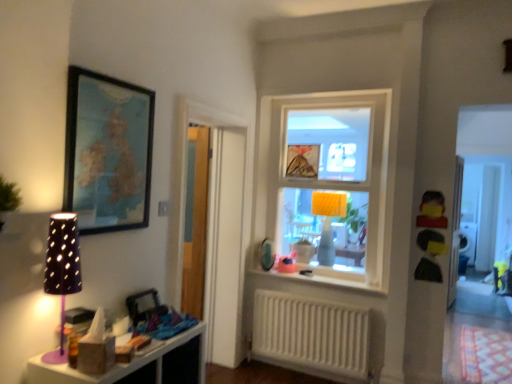
This screenshot has width=512, height=384. What do you see at coordinates (138, 365) in the screenshot?
I see `matte plastic shelf at lower left` at bounding box center [138, 365].

The height and width of the screenshot is (384, 512). Describe the element at coordinates (311, 336) in the screenshot. I see `white plastic radiator at lower center` at that location.

Where is `wooden framed map at upper left`? wooden framed map at upper left is located at coordinates (106, 152).

Find the location of a particular element. Image resolution: width=512 pixels, height=384 pixels. white glossy window sill at center is located at coordinates (324, 280).

Measure the distance between transparent wooden door at left and white plastic radiator at lower center.

They are 26.31 inches apart.

The image size is (512, 384). What are the coordinates of `radiator below the transparent wooden door at left (from a real-world perspective)` in the screenshot? It's located at (311, 336).

Which of these two, transparent wooden door at left or white plastic radiator at lower center, is smaller?

Smaller between the two is white plastic radiator at lower center.

Between transparent wooden door at left and white plastic radiator at lower center, which one appears on the right side from the viewer's perspective?

Positioned to the right is white plastic radiator at lower center.

Considering the positions of objects matte plastic toy at center, positioned as the first toy in bottom-to-top order, and white glossy window sill at center in the image provided, who is more to the left, matte plastic toy at center, positioned as the first toy in bottom-to-top order, or white glossy window sill at center?

matte plastic toy at center, positioned as the first toy in bottom-to-top order.

What's the angular difference between matte plastic toy at center, acting as the second toy starting from the top, and white glossy window sill at center's facing directions?

There is a 53.7-degree angle between the facing directions of matte plastic toy at center, acting as the second toy starting from the top, and white glossy window sill at center.

Find the location of a particular element. This screenshot has height=384, width=512. toy that is the 1st one when counting upward from the white glossy window sill at center (from the image's perspective) is located at coordinates pyautogui.click(x=287, y=263).

From the picture: Does matte plastic toy at center, which appears as the second toy when viewed from the right, turn towards white glossy window sill at center?

Yes, matte plastic toy at center, which appears as the second toy when viewed from the right, is turned towards white glossy window sill at center.

Is yellow matte toy at right, the 1th toy when ordered from top to bottom, beside yellow fabric lampshade at center, which ranks as the second table lamp in front-to-back order?

No, yellow matte toy at right, the 1th toy when ordered from top to bottom, is not next to yellow fabric lampshade at center, which ranks as the second table lamp in front-to-back order.

Who is smaller, yellow matte toy at right, arranged as the 2th toy when viewed from the back, or yellow fabric lampshade at center, the 2th table lamp viewed from the left?

Smaller between the two is yellow matte toy at right, arranged as the 2th toy when viewed from the back.

Is yellow matte toy at right, which is the 2th toy in left-to-right order, oriented towards yellow fabric lampshade at center, which ranks as the second table lamp in front-to-back order?

No, yellow matte toy at right, which is the 2th toy in left-to-right order, is not turned towards yellow fabric lampshade at center, which ranks as the second table lamp in front-to-back order.

Is point (431, 190) positioned before point (313, 211)?

Yes, it is.

Which of these two, matte plastic shelf at lower left or yellow fabric lampshade at center, which ranks as the second table lamp in front-to-back order, is thinner?

yellow fabric lampshade at center, which ranks as the second table lamp in front-to-back order.

Considering the positions of objects matte plastic shelf at lower left and yellow fabric lampshade at center, which is the 1th table lamp in back-to-front order, in the image provided, who is behind, matte plastic shelf at lower left or yellow fabric lampshade at center, which is the 1th table lamp in back-to-front order,?

Positioned behind is yellow fabric lampshade at center, which is the 1th table lamp in back-to-front order.

Where is `shelf below the yellow fabric lampshade at center, which is the 1th table lamp in back-to-front order (from a real-world perspective)`? The image size is (512, 384). shelf below the yellow fabric lampshade at center, which is the 1th table lamp in back-to-front order (from a real-world perspective) is located at coordinates (138, 365).

Is matte plastic shelf at lower left touching yellow fabric lampshade at center, which is the 1th table lamp in back-to-front order?

No, matte plastic shelf at lower left is not next to yellow fabric lampshade at center, which is the 1th table lamp in back-to-front order.

Is point (298, 197) closer or farther from the camera than point (282, 263)?

Point (298, 197) is farther from the camera than point (282, 263).

In the scene shown: Which of these two, clear glass window at center or matte plastic toy at center, which is the 2th toy in front-to-back order, stands taller?

clear glass window at center is taller.

From the image's perspective, relative to matte plastic toy at center, which is the 2th toy in front-to-back order, is matte plastic shelf at lower left above or below?

Clearly, from the image's perspective, matte plastic shelf at lower left is below matte plastic toy at center, which is the 2th toy in front-to-back order.

Based on their sizes in the image, would you say matte plastic shelf at lower left is bigger or smaller than matte plastic toy at center, which appears as the second toy when viewed from the right?

Considering their sizes, matte plastic shelf at lower left takes up more space than matte plastic toy at center, which appears as the second toy when viewed from the right.

Between point (173, 379) and point (292, 253), which one is positioned in front?

Positioned in front is point (173, 379).

Looking at this image, considering their positions, is matte plastic shelf at lower left located in front of or behind matte plastic toy at center, positioned as the first toy in back-to-front order?

matte plastic shelf at lower left is positioned closer to the viewer than matte plastic toy at center, positioned as the first toy in back-to-front order.

Is matte plastic toy at center, which appears as the second toy when viewed from the right, thinner than wooden framed map at upper left?

No, matte plastic toy at center, which appears as the second toy when viewed from the right, is not thinner than wooden framed map at upper left.

Considering the points (287, 255) and (134, 151), which point is behind, point (287, 255) or point (134, 151)?

The point (287, 255) is behind.

From the image's perspective, is matte plastic toy at center, acting as the second toy starting from the top, under wooden framed map at upper left?

Indeed, from the image's perspective, matte plastic toy at center, acting as the second toy starting from the top, is shown beneath wooden framed map at upper left.

Would you say matte plastic toy at center, which appears as the second toy when viewed from the right, is to the left or to the right of wooden framed map at upper left in the picture?

Clearly, matte plastic toy at center, which appears as the second toy when viewed from the right, is on the right of wooden framed map at upper left in the image.

Locate an element on the screen. The height and width of the screenshot is (384, 512). radiator lying below the transparent wooden door at left (from the image's perspective) is located at coordinates (311, 336).

Image resolution: width=512 pixels, height=384 pixels. Identify the location of toy lying behind the white glossy window sill at center. (287, 263).

When comparing their distances from yellow matte toy at right, arranged as the 1th toy when viewed from the right, does transparent wooden door at left or white plastic radiator at lower center seem closer?

white plastic radiator at lower center is closer to yellow matte toy at right, arranged as the 1th toy when viewed from the right.

Considering their positions, is yellow fabric lampshade at center, which is the 1th table lamp in back-to-front order, positioned further to transparent wooden door at left than yellow matte toy at right, the 1th toy positioned from the front?

yellow matte toy at right, the 1th toy positioned from the front, lies further to transparent wooden door at left than the other object.

Based on their spatial positions, is white plastic radiator at lower center or white glossy window sill at center closer to clear glass window at center?

white glossy window sill at center is closer to clear glass window at center.

Looking at the image, which one is located closer to clear glass window at center, matte plastic shelf at lower left or matte plastic toy at center, positioned as the first toy in back-to-front order?

matte plastic toy at center, positioned as the first toy in back-to-front order, lies closer to clear glass window at center than the other object.

Looking at the image, which one is located further to purple matte table lamp at left, which is the 1th table lamp from front to back, matte plastic toy at center, the first toy from the left, or matte plastic shelf at lower left?

matte plastic toy at center, the first toy from the left.

From the image, which object appears to be farther from purple matte table lamp at left, which is the first table lamp from left to right, white glossy window sill at center or yellow fabric lampshade at center, which ranks as the second table lamp in front-to-back order?

yellow fabric lampshade at center, which ranks as the second table lamp in front-to-back order, is further to purple matte table lamp at left, which is the first table lamp from left to right.

From the image, which object appears to be farther from clear glass window at center, wooden framed map at upper left or matte plastic shelf at lower left?

matte plastic shelf at lower left is positioned further to the anchor clear glass window at center.

Based on their spatial positions, is white glossy window sill at center or matte plastic shelf at lower left closer to clear glass window at center?

white glossy window sill at center is positioned closer to the anchor clear glass window at center.

You are a GUI agent. You are given a task and a screenshot of the screen. Output one action in this format:
    pyautogui.click(x=<x>, y=<y>)
    Task: Click on the window sill between matte plastic toy at center, the first toy from the left, and white plastic radiator at lower center vertically
    
    Given the screenshot: What is the action you would take?
    pyautogui.click(x=324, y=280)

The height and width of the screenshot is (384, 512). Find the location of `window located between transparent wooden door at left and yellow matte toy at right, the 1th toy positioned from the front, in the left-right direction`. window located between transparent wooden door at left and yellow matte toy at right, the 1th toy positioned from the front, in the left-right direction is located at coordinates (329, 178).

Find the location of a particular element. window between purple matte table lamp at left, which ranks as the second table lamp in back-to-front order, and matte plastic toy at center, positioned as the first toy in bottom-to-top order, in the front-back direction is located at coordinates (329, 178).

Locate an element on the screen. window between matte plastic shelf at lower left and white glossy window sill at center in the front-back direction is located at coordinates (329, 178).